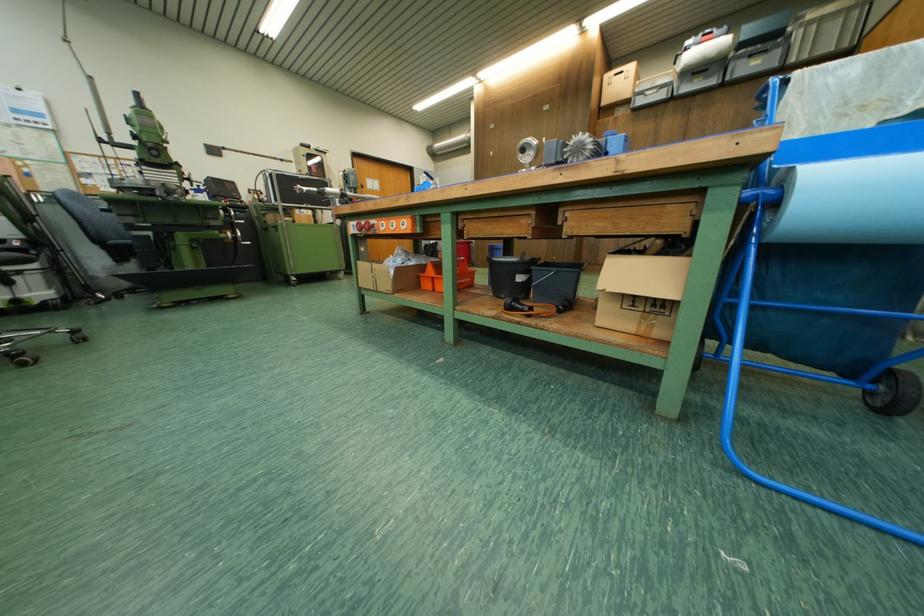
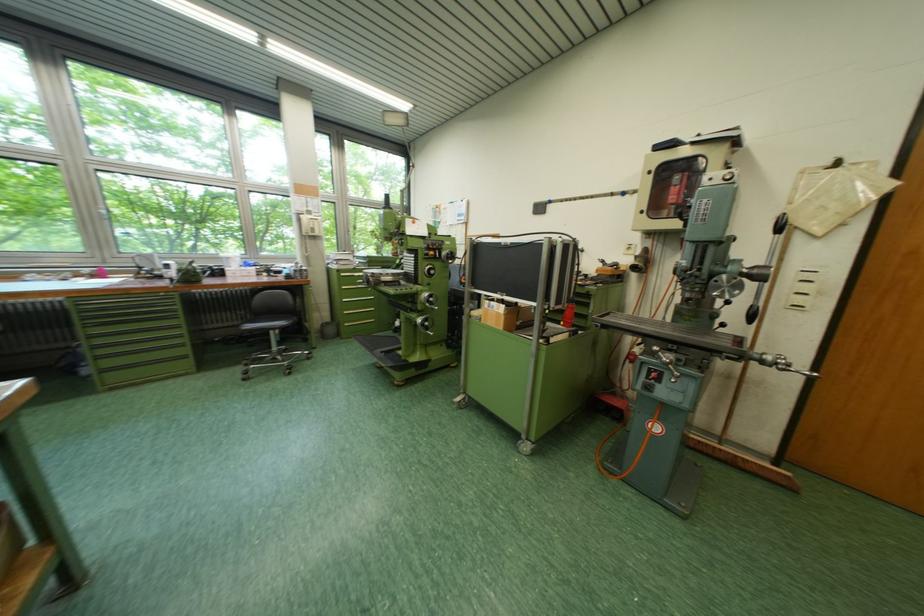
Locate, in the second image, the point that corresponds to (311,213) in the first image.

(503, 305)